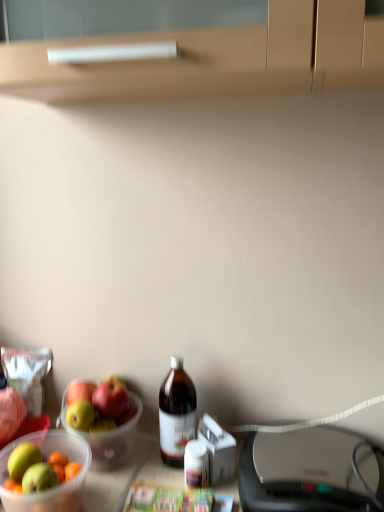
Describe the element at coordinates (310, 472) in the screenshot. I see `matte black printer at lower right` at that location.

The image size is (384, 512). What do you see at coordinates (176, 413) in the screenshot? I see `brown glass bottle at center` at bounding box center [176, 413].

What do you see at coordinates (53, 487) in the screenshot?
I see `translucent plastic bowl at lower left` at bounding box center [53, 487].

Where is `translucent plastic bowl at lower left`? The width and height of the screenshot is (384, 512). translucent plastic bowl at lower left is located at coordinates (53, 487).

At what (x,y) coordinates should I click in order to perform the action: click on matte black printer at lower right. Please return your answer as a coordinate pair (x, y). This screenshot has width=384, height=512. Looking at the image, I should click on (310, 472).

From the image's perspective, which one is positioned lower, brown glass bottle at center or matte black printer at lower right?

matte black printer at lower right.

Based on the photo, is brown glass bottle at center shorter than matte black printer at lower right?

No, brown glass bottle at center is not shorter than matte black printer at lower right.

Is there a large distance between brown glass bottle at center and matte black printer at lower right?

They are positioned close to each other.

From the picture: Who is bigger, brown glass bottle at center or matte black printer at lower right?

With larger size is matte black printer at lower right.

From a real-world perspective, who is located lower, brown glass bottle at center or translucent plastic bowl at lower left?

translucent plastic bowl at lower left is physically lower.

Considering the relative sizes of brown glass bottle at center and translucent plastic bowl at lower left in the image provided, is brown glass bottle at center wider than translucent plastic bowl at lower left?

No.

Considering the sizes of objects brown glass bottle at center and translucent plastic bowl at lower left in the image provided, who is taller, brown glass bottle at center or translucent plastic bowl at lower left?

Standing taller between the two is brown glass bottle at center.

Locate an element on the screen. The width and height of the screenshot is (384, 512). bottle on the right of translucent plastic bowl at lower left is located at coordinates (176, 413).

Is matte black printer at lower right taller or shorter than brown glass bottle at center?

matte black printer at lower right is shorter than brown glass bottle at center.

In the image, there is a brown glass bottle at center. What are the coordinates of `wide below it (from the image's perspective)` in the screenshot? It's located at (310, 472).

Between point (248, 481) and point (170, 380), which one is positioned behind?

The point (170, 380) is behind.

Is matte black printer at lower right oriented towards brown glass bottle at center?

No, matte black printer at lower right is not turned towards brown glass bottle at center.

Does translucent plastic bowl at lower left have a lesser width compared to brown glass bottle at center?

No.

Is translucent plastic bowl at lower left next to brown glass bottle at center?

translucent plastic bowl at lower left is not next to brown glass bottle at center, and they're not touching.

Is translucent plastic bowl at lower left positioned beyond the bounds of brown glass bottle at center?

Absolutely, translucent plastic bowl at lower left is external to brown glass bottle at center.

At what (x,y) coordinates should I click in order to perform the action: click on bowl on the left of brown glass bottle at center. Please return your answer as a coordinate pair (x, y). Looking at the image, I should click on (53, 487).

Measure the distance from matte black printer at lower right to translucent plastic bowl at lower left.

They are 44.65 centimeters apart.

Is matte black printer at lower right at the right side of translucent plastic bowl at lower left?

Yes.

Identify the location of bowl lying above the matte black printer at lower right (from the image's perspective). (53, 487).

Based on the photo, considering the sizes of objects matte black printer at lower right and translucent plastic bowl at lower left in the image provided, who is shorter, matte black printer at lower right or translucent plastic bowl at lower left?

matte black printer at lower right.

Visually, is translucent plastic bowl at lower left positioned to the left or to the right of matte black printer at lower right?

translucent plastic bowl at lower left is to the left of matte black printer at lower right.

Considering the positions of points (31, 436) and (285, 484), is point (31, 436) closer to camera compared to point (285, 484)?

No, (31, 436) is further to viewer.

Find the location of `wide lying below the translucent plastic bowl at lower left (from the image's perspective)`. wide lying below the translucent plastic bowl at lower left (from the image's perspective) is located at coordinates (310, 472).

Locate an element on the screen. wide directly beneath the brown glass bottle at center (from a real-world perspective) is located at coordinates (310, 472).

The image size is (384, 512). In order to click on bowl on the left side of brown glass bottle at center in this screenshot , I will do `click(53, 487)`.

In the scene shown: Looking at the image, which one is located closer to matte black printer at lower right, brown glass bottle at center or translucent plastic bowl at lower left?

Based on the image, brown glass bottle at center appears to be nearer to matte black printer at lower right.

When comparing their distances from translucent plastic bowl at lower left, does brown glass bottle at center or matte black printer at lower right seem further?

matte black printer at lower right lies further to translucent plastic bowl at lower left than the other object.

Based on their spatial positions, is matte black printer at lower right or brown glass bottle at center closer to translucent plastic bowl at lower left?

brown glass bottle at center lies closer to translucent plastic bowl at lower left than the other object.

Looking at the image, which one is located further to matte black printer at lower right, translucent plastic bowl at lower left or brown glass bottle at center?

translucent plastic bowl at lower left lies further to matte black printer at lower right than the other object.

Considering their positions, is matte black printer at lower right positioned further to brown glass bottle at center than translucent plastic bowl at lower left?

Based on the image, matte black printer at lower right appears to be further to brown glass bottle at center.

From the image, which object appears to be nearer to brown glass bottle at center, translucent plastic bowl at lower left or matte black printer at lower right?

Based on the image, translucent plastic bowl at lower left appears to be nearer to brown glass bottle at center.

You are a GUI agent. You are given a task and a screenshot of the screen. Output one action in this format:
    pyautogui.click(x=<x>, y=<y>)
    Task: Click on the bottle situated between translucent plastic bowl at lower left and matte black printer at lower right from left to right
    
    Given the screenshot: What is the action you would take?
    pyautogui.click(x=176, y=413)